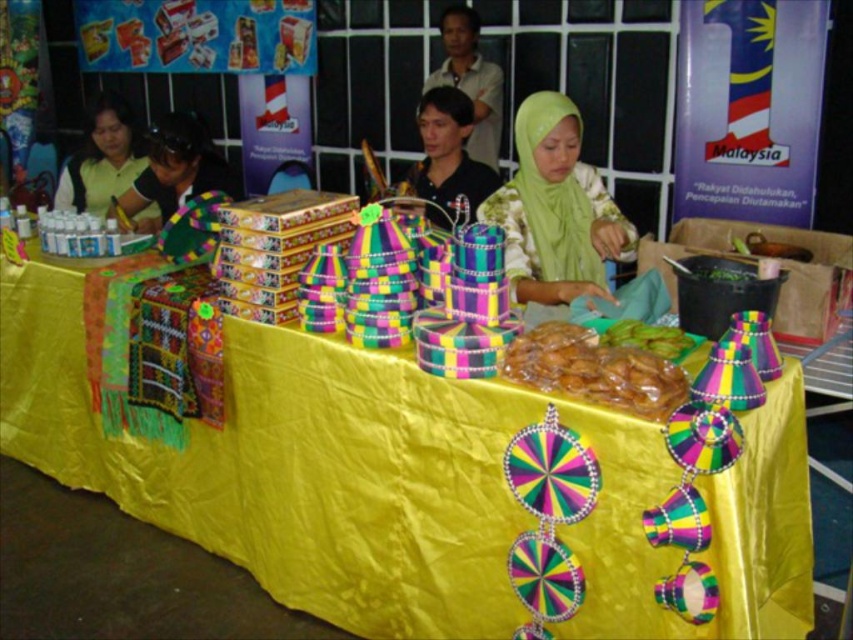
Is translucent plastic bag at center thinner than black fabric headscarf at upper left?

Yes.

Is translucent plastic bag at center further to camera compared to black fabric headscarf at upper left?

No, translucent plastic bag at center is in front of black fabric headscarf at upper left.

Between point (550, 330) and point (195, 148), which one is positioned in front?

Point (550, 330) is in front.

Where is `translucent plastic bag at center`? The width and height of the screenshot is (853, 640). translucent plastic bag at center is located at coordinates (595, 371).

Can you confirm if yellow fabric table at center is positioned to the left of matte yellow shirt at upper left?

No, yellow fabric table at center is not to the left of matte yellow shirt at upper left.

Does yellow fabric table at center have a greater width compared to matte yellow shirt at upper left?

Yes, yellow fabric table at center is wider than matte yellow shirt at upper left.

Locate an element on the screen. This screenshot has height=640, width=853. yellow fabric table at center is located at coordinates (398, 481).

Who is positioned more to the right, yellow fabric table at center or black fabric headscarf at upper left?

Positioned to the right is yellow fabric table at center.

Who is more forward, (x=317, y=387) or (x=239, y=196)?

Point (x=317, y=387) is in front.

Which is behind, point (256, 570) or point (128, 214)?

The point (128, 214) is behind.

What are the coordinates of `yellow fabric table at center` in the screenshot? It's located at (398, 481).